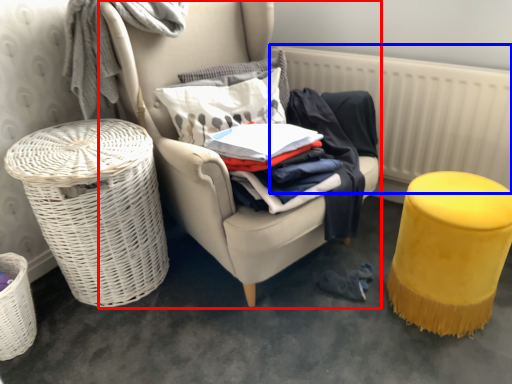
Question: Which object is further to the camera taking this photo, chair (highlighted by a red box) or radiator (highlighted by a blue box)?

Choices:
 (A) chair
 (B) radiator

Answer: (B)